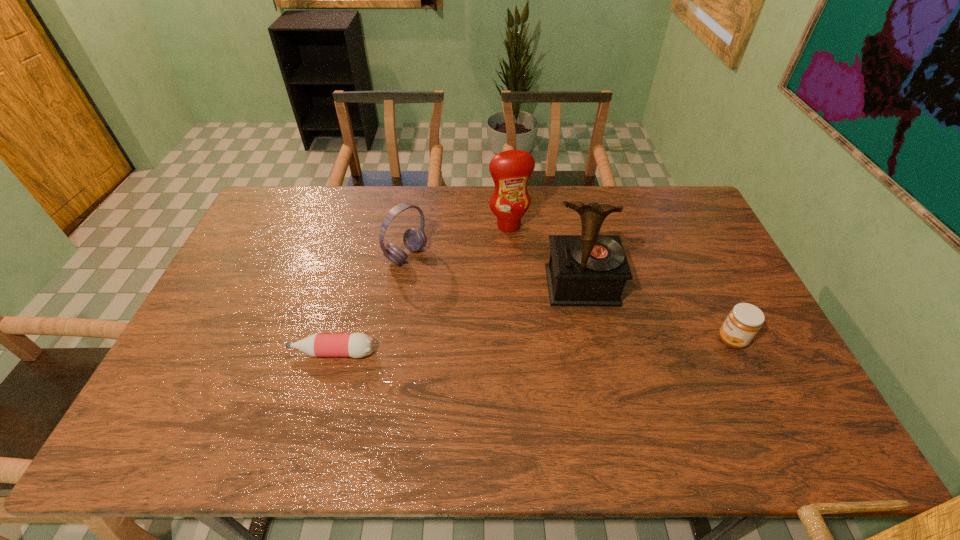
This screenshot has width=960, height=540. I want to click on free region located at the horn opening of the fourth object from left to right, so click(x=604, y=395).

You are a GUI agent. You are given a task and a screenshot of the screen. Output one action in this format:
    pyautogui.click(x=<x>, y=<y>)
    Task: Click on the free point located 0.230m at the horn opening of the fourth object from left to right
    
    Given the screenshot: What is the action you would take?
    pyautogui.click(x=600, y=377)

This screenshot has width=960, height=540. Find the location of `vacant area situated at the horn opening of the fourth object from left to right`. vacant area situated at the horn opening of the fourth object from left to right is located at coordinates (597, 363).

Find the location of `object positioned at the far edge`. object positioned at the far edge is located at coordinates (510, 170).

Image resolution: width=960 pixels, height=540 pixels. Identify the location of object at the right edge. (743, 322).

Where is `vacant area at the far edge`? vacant area at the far edge is located at coordinates (337, 198).

Image resolution: width=960 pixels, height=540 pixels. Find the location of `vacant space at the near edge of the desktop`. vacant space at the near edge of the desktop is located at coordinates (448, 387).

You are a GUI agent. You are given a task and a screenshot of the screen. Output one action in this format:
    pyautogui.click(x=<x>, y=<y>)
    Task: Click on the vacant region at the left edge of the desktop
    
    Given the screenshot: What is the action you would take?
    pyautogui.click(x=273, y=235)

Find the location of a particular element. vacant space at the near right corner of the desktop is located at coordinates (787, 378).

This screenshot has width=960, height=540. What are the coordinates of `free space between the headset and the bottle` in the screenshot? It's located at (370, 304).